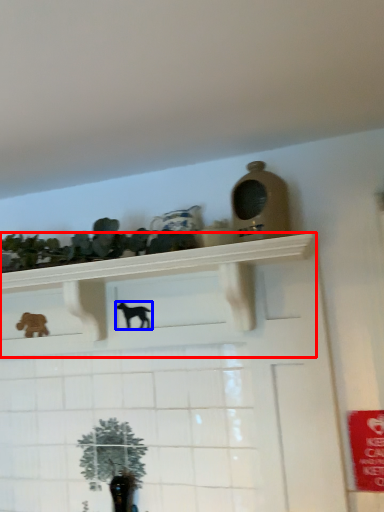
Question: Among these objects, which one is farthest to the camera, shelf (highlighted by a red box) or animal (highlighted by a blue box)?

Choices:
 (A) shelf
 (B) animal

Answer: (B)